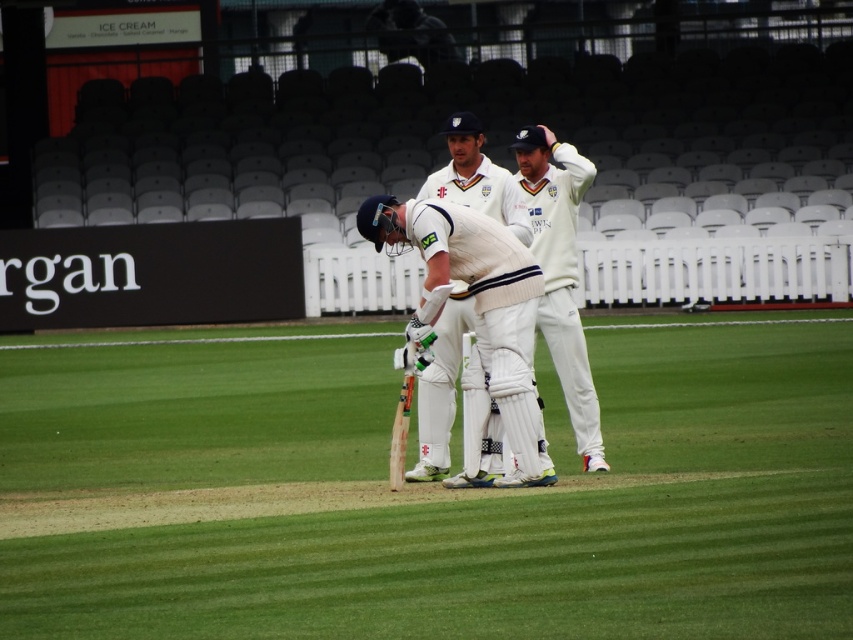
Does point (471, 221) lie behind point (514, 228)?

No.

Is white cotton cricket uniform at center to the left of white matte cricket bat at center from the viewer's perspective?

Correct, you'll find white cotton cricket uniform at center to the left of white matte cricket bat at center.

Who is more forward, (x=451, y=356) or (x=495, y=216)?

Point (x=451, y=356) is in front.

You are a GUI agent. You are given a task and a screenshot of the screen. Output one action in this format:
    pyautogui.click(x=<x>, y=<y>)
    Task: Click on the white cotton cricket uniform at center
    The height and width of the screenshot is (640, 853).
    Given the screenshot: What is the action you would take?
    pyautogui.click(x=469, y=294)

Which is more to the right, white textured cricket uniform at center or white matte cricket bat at center?

white textured cricket uniform at center

Is point (572, 294) positioned in front of point (436, 438)?

No, (572, 294) is further to viewer.

This screenshot has height=640, width=853. Identify the location of white textured cricket uniform at center. (560, 273).

Does white cotton cricket uniform at center have a greater width compared to white textured cricket uniform at center?

Yes.

Measure the distance between white cotton cricket uniform at center and camera.

The distance of white cotton cricket uniform at center from camera is 10.42 meters.

Is point (495, 355) closer to viewer compared to point (575, 320)?

Yes, point (495, 355) is closer to viewer.

Image resolution: width=853 pixels, height=640 pixels. Find the location of `white cotton cricket uniform at center`. white cotton cricket uniform at center is located at coordinates (469, 294).